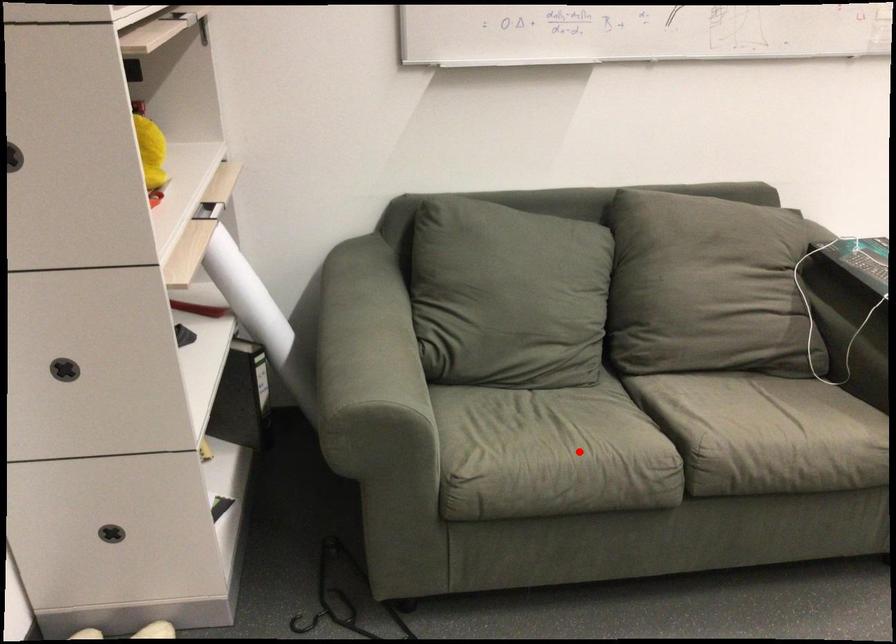
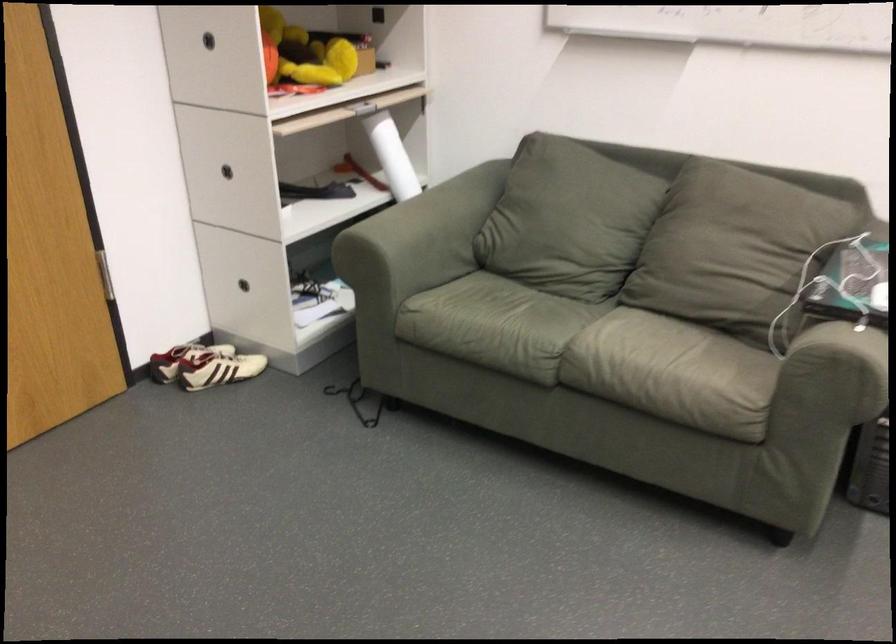
Question: I am providing you with two images of the same scene from different viewpoints. In image1, a red point is highlighted. Considering the same 3D point in image2, which of the following is correct?

Choices:
 (A) It is closer
 (B) It is farther

Answer: (B)